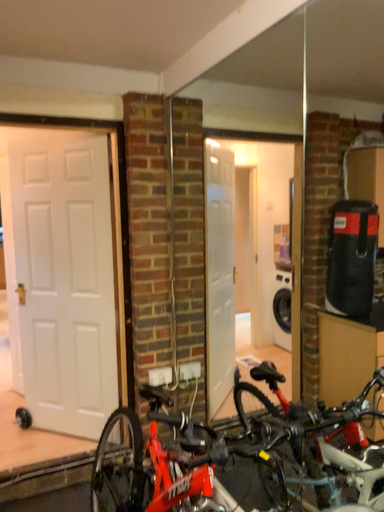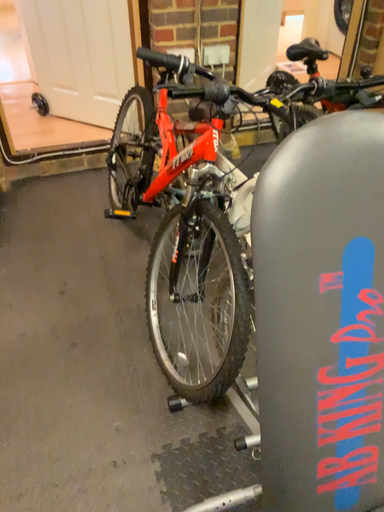
Question: How did the camera likely rotate when shooting the video?

Choices:
 (A) rotated left
 (B) rotated right

Answer: (A)